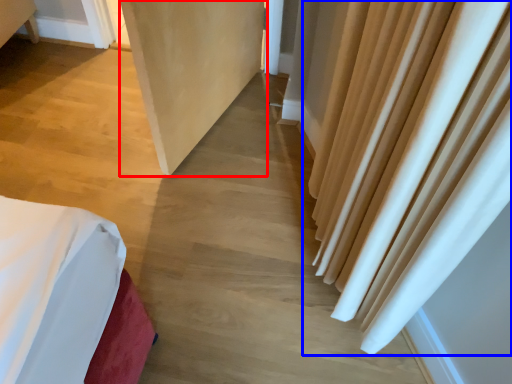
Question: Among these objects, which one is nearest to the camera, screen door (highlighted by a red box) or curtain (highlighted by a blue box)?

Choices:
 (A) screen door
 (B) curtain

Answer: (A)